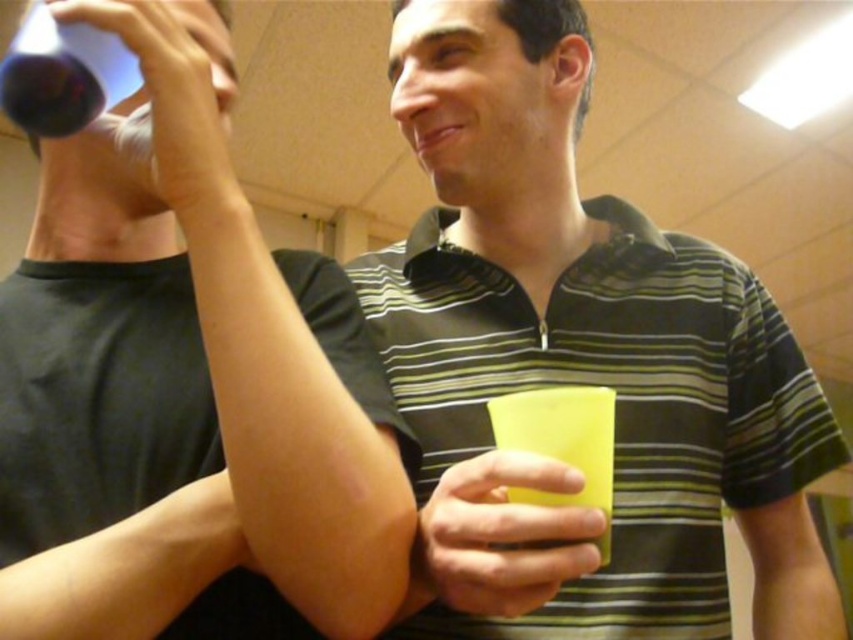
You are at a party and need to grab a drink quickly. You see the matte green cup at right and the yellow matte cup at lower center. Which cup is closer to your current position if you are standing directly in front of the scene?

The yellow matte cup at lower center is closer to your current position because it is located at lower center, while the matte green cup at right is positioned further to the right side of the scene.